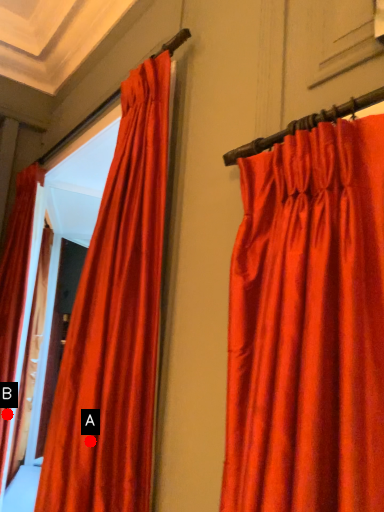
Question: Two points are circled on the image, labeled by A and B beside each circle. Which point appears closest to the camera in this image?

Choices:
 (A) A is closer
 (B) B is closer

Answer: (A)